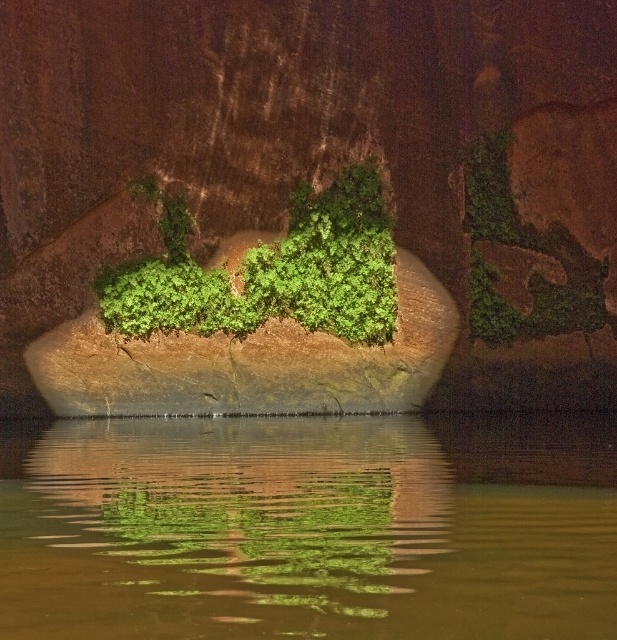
Who is more distant from viewer, (x=143, y=556) or (x=308, y=307)?

The point (x=308, y=307) is behind.

You are a GUI agent. You are given a task and a screenshot of the screen. Output one action in this format:
    pyautogui.click(x=<x>, y=<y>)
    Task: Click on the green reflective water at center
    The image size is (617, 640).
    Given the screenshot: What is the action you would take?
    pyautogui.click(x=308, y=528)